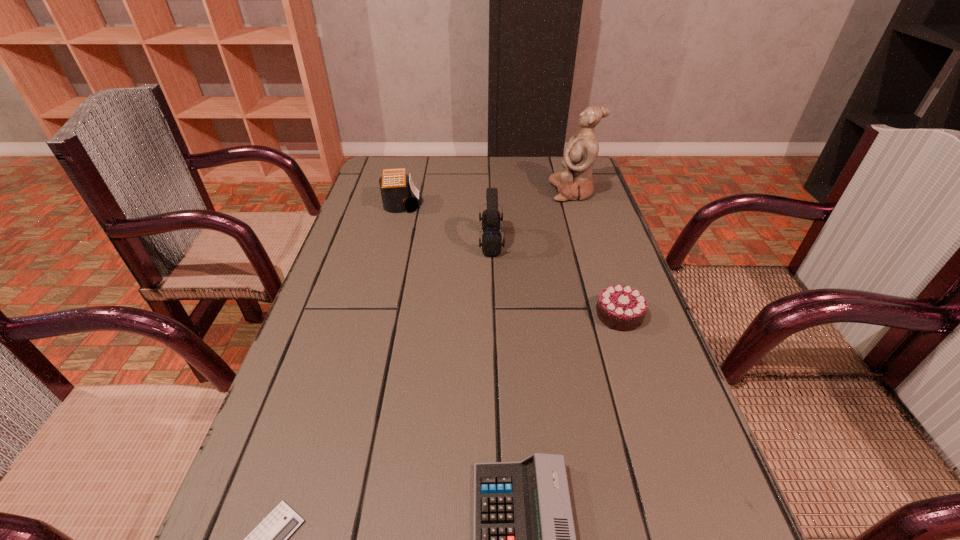
Locate an element on the screen. This screenshot has height=540, width=960. free space at the left edge of the desktop is located at coordinates (396, 218).

Image resolution: width=960 pixels, height=540 pixels. In the image, there is a desktop. In order to click on vacant region at the right edge in this screenshot , I will do point(663,403).

Find the location of `vacant region at the far right corner`. vacant region at the far right corner is located at coordinates (548, 174).

Locate an element on the screen. free space between the fourth tallest object and the third farthest object is located at coordinates (555, 279).

This screenshot has width=960, height=540. I want to click on empty space between the second tallest object and the third nearest object, so click(555, 279).

You are a GUI agent. You are given a task and a screenshot of the screen. Output one action in this format:
    pyautogui.click(x=<x>, y=<y>)
    Task: Click on the vacant space in between the figurine and the fourth nearest object
    The image size is (960, 540).
    Given the screenshot: What is the action you would take?
    pyautogui.click(x=532, y=217)

Where is `free space that is in between the farthest calculator and the fourth nearest object`? The width and height of the screenshot is (960, 540). free space that is in between the farthest calculator and the fourth nearest object is located at coordinates (446, 224).

Select which object appears as the closest to the rightmost calculator. Please provide its 2D coordinates. Your answer should be formatted as a tuple, i.e. [(x, y)], where the tuple contains the x and y coordinates of a point satisfying the conditions above.

[(269, 539)]

Identify which object is located as the third nearest to the tallest object. Please provide its 2D coordinates. Your answer should be formatted as a tuple, i.e. [(x, y)], where the tuple contains the x and y coordinates of a point satisfying the conditions above.

[(622, 308)]

What are the coordinates of `calculator that is the nearest to the fourth farthest object` in the screenshot? It's located at tap(524, 539).